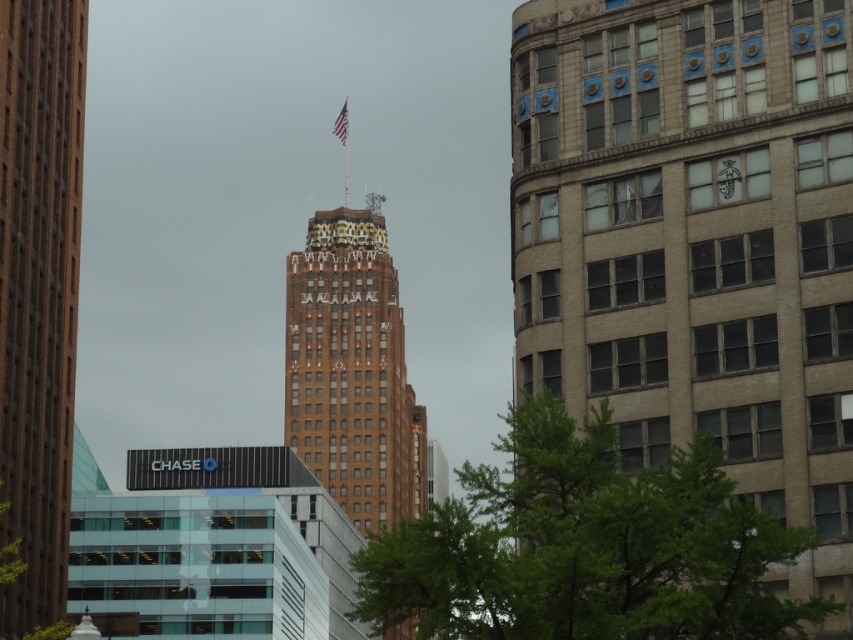
Question: Does brown brick tower at center appear on the left side of brown brick building at center?

Choices:
 (A) no
 (B) yes

Answer: (B)

Question: Which of the following is the closest to the observer?

Choices:
 (A) (21, 92)
 (B) (763, 634)
 (C) (345, 106)
 (D) (590, 22)

Answer: (B)

Question: Which point appears farthest from the camera in this image?

Choices:
 (A) (512, 115)
 (B) (303, 320)
 (C) (337, 134)
 (D) (15, 120)

Answer: (C)

Question: Does green leafy tree at center have a smaller size compared to brown brick tower at center?

Choices:
 (A) yes
 (B) no

Answer: (B)

Question: Which point is closer to the camera?

Choices:
 (A) green leafy tree at center
 (B) brown brick tower at center
 (C) red fabric flag at upper center
 (D) brown stone building at center

Answer: (A)

Question: Is brown brick building at center behind red fabric flag at upper center?

Choices:
 (A) yes
 (B) no

Answer: (B)